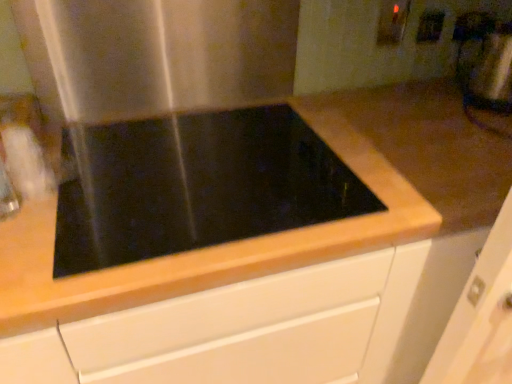
Question: Would you say matte white electric outlet at upper right, which is the 2th electric outlet from right to left, is to the left or to the right of black glass cooktop at center in the picture?

Choices:
 (A) left
 (B) right

Answer: (B)

Question: In terms of height, does matte white electric outlet at upper right, which is the 2th electric outlet from right to left, look taller or shorter compared to black glass cooktop at center?

Choices:
 (A) short
 (B) tall

Answer: (B)

Question: Estimate the real-world distances between objects in this image. Which object is closer to the metallic silver blender at upper right?

Choices:
 (A) white plastic electric outlet at upper right, the first electric outlet from the right
 (B) stainless steel at upper left
 (C) black glass cooktop at center
 (D) matte white electric outlet at upper right, which is the 2th electric outlet from right to left

Answer: (A)

Question: Which is nearer to the metallic silver blender at upper right?

Choices:
 (A) white plastic electric outlet at upper right, the first electric outlet from the right
 (B) black glass cooktop at center
 (C) stainless steel at upper left
 (D) matte white electric outlet at upper right, which is the 1th electric outlet from left to right

Answer: (A)